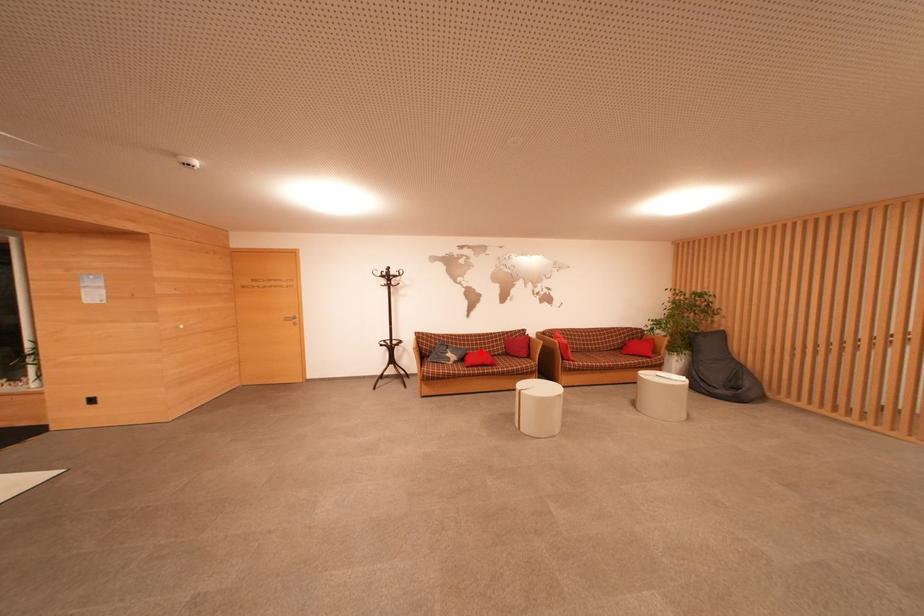
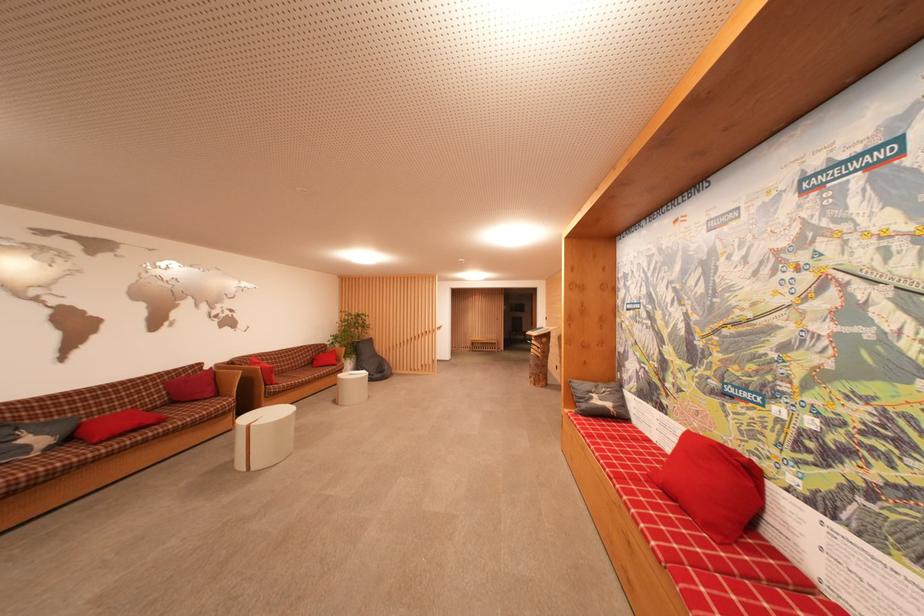
Where in the second image is the point corresponding to the highlighted location from the first image?

(104, 415)